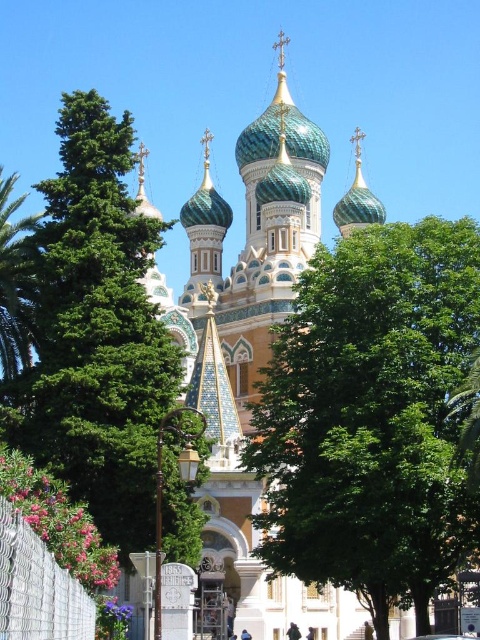
Question: Does green leafy tree at center have a larger size compared to green leafy tree at left?

Choices:
 (A) yes
 (B) no

Answer: (A)

Question: Does green leafy tree at center appear on the left side of green leafy tree at left?

Choices:
 (A) no
 (B) yes

Answer: (A)

Question: Among these objects, which one is farthest from the camera?

Choices:
 (A) green leafy tree at left
 (B) green leafy tree at center

Answer: (A)

Question: Which point is closer to the camera?

Choices:
 (A) (351, 353)
 (B) (134, 339)

Answer: (A)

Question: Is green leafy tree at center bigger than green leafy tree at left?

Choices:
 (A) no
 (B) yes

Answer: (B)